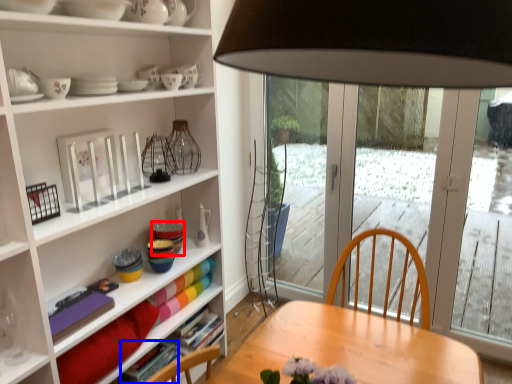
Question: Which object appears closest to the camera in this image, tableware (highlighted by a red box) or book (highlighted by a blue box)?

Choices:
 (A) tableware
 (B) book

Answer: (B)